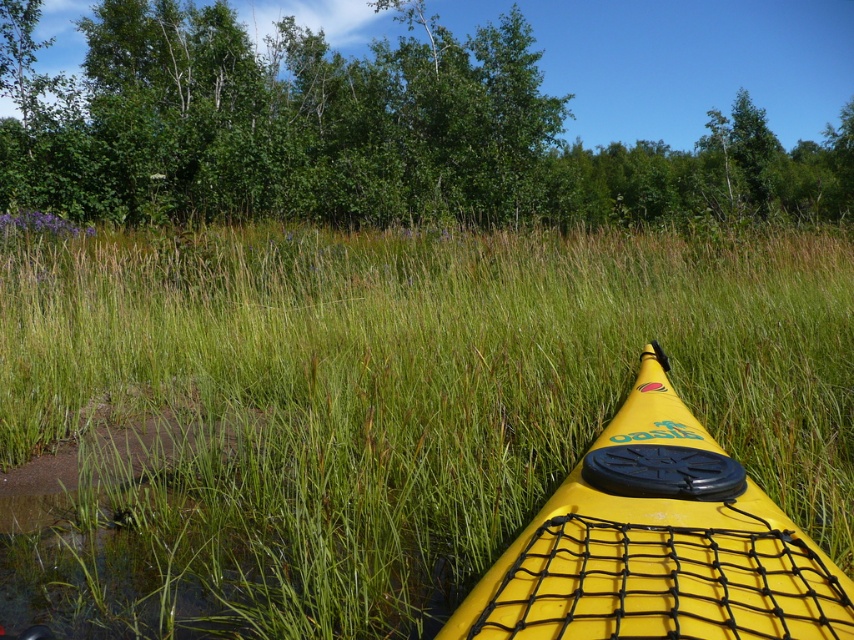
You are standing on the green grassy at center and want to reach the yellow matte kayak at center. Which direction should you move to get closer to the kayak?

Since the green grassy at center is further to the viewer than the yellow matte kayak at center, you should move forward towards the kayak to get closer.

You are planning to take a photo of the yellow matte kayak at center. Since the green grassy at center is in the background, will the kayak be mostly visible in the photo?

The green grassy at center is bigger than yellow matte kayak at center, so the kayak may be partially obscured by the larger grassy area in the background.